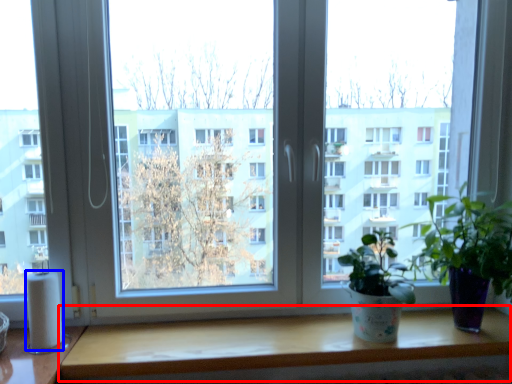
Question: Which point is closer to the camera, table (highlighted by a red box) or toilet paper (highlighted by a blue box)?

Choices:
 (A) table
 (B) toilet paper

Answer: (A)